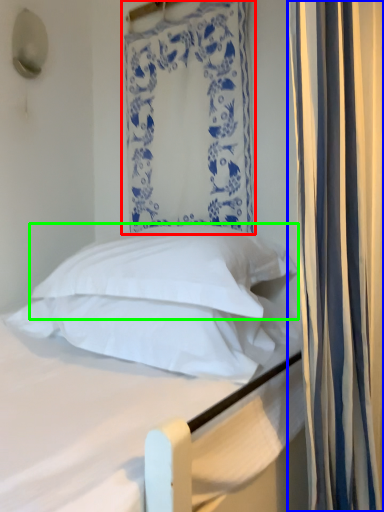
Question: Which object is the closest to the curtain (highlighted by a red box)? Choose among these: curtain (highlighted by a blue box) or pillow (highlighted by a green box).

Choices:
 (A) curtain
 (B) pillow

Answer: (B)